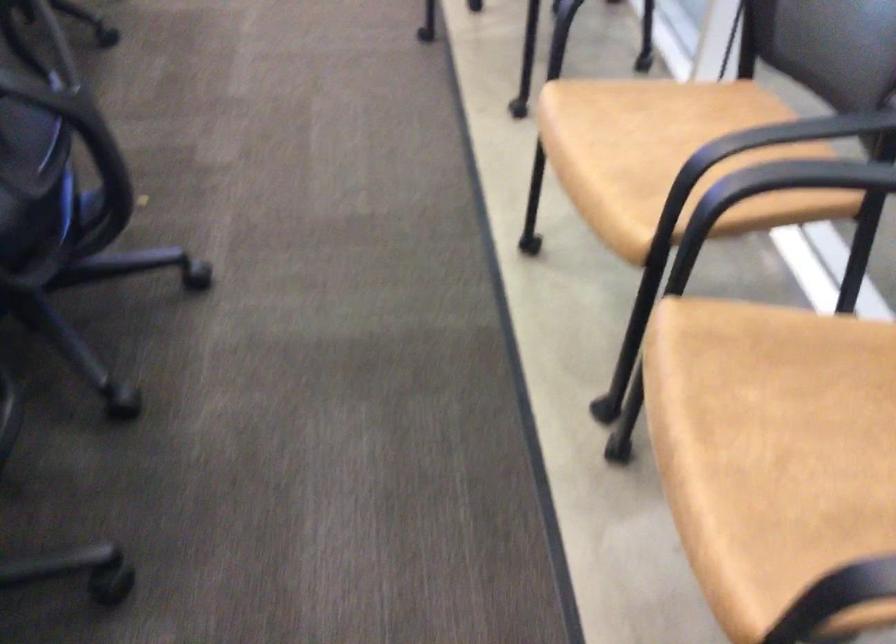
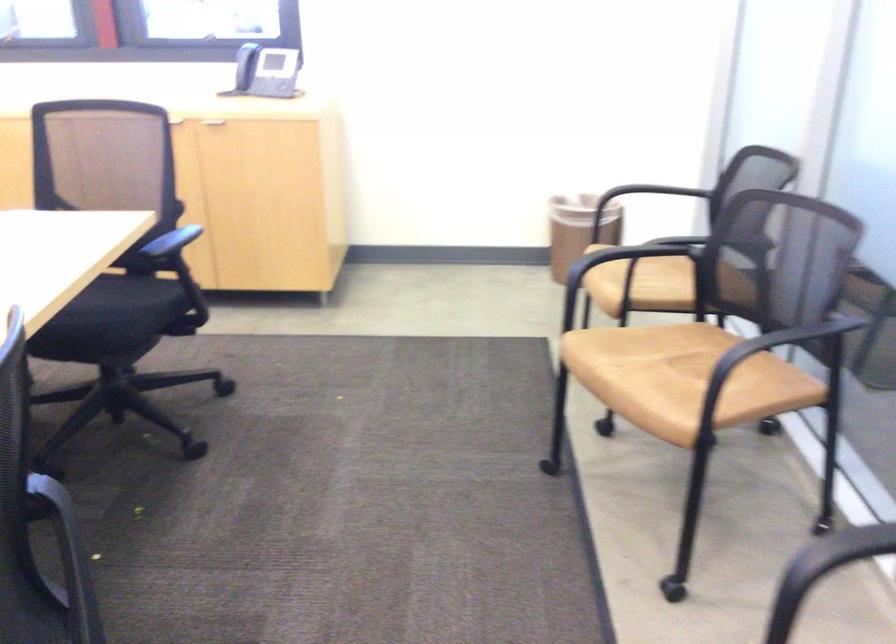
Question: The images are taken continuously from a first-person perspective. In which direction is your viewpoint rotating?

Choices:
 (A) Left
 (B) Right
 (C) Up
 (D) Down

Answer: (C)